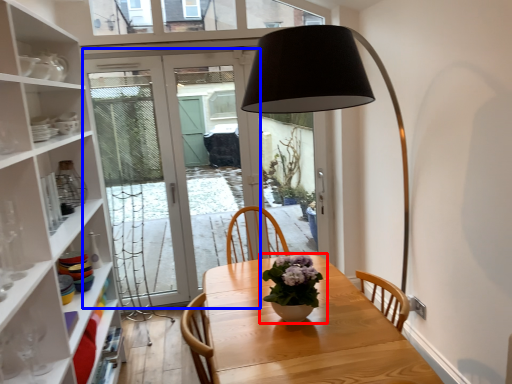
Question: Which object is further to the camera taking this photo, houseplant (highlighted by a red box) or door (highlighted by a blue box)?

Choices:
 (A) houseplant
 (B) door

Answer: (B)